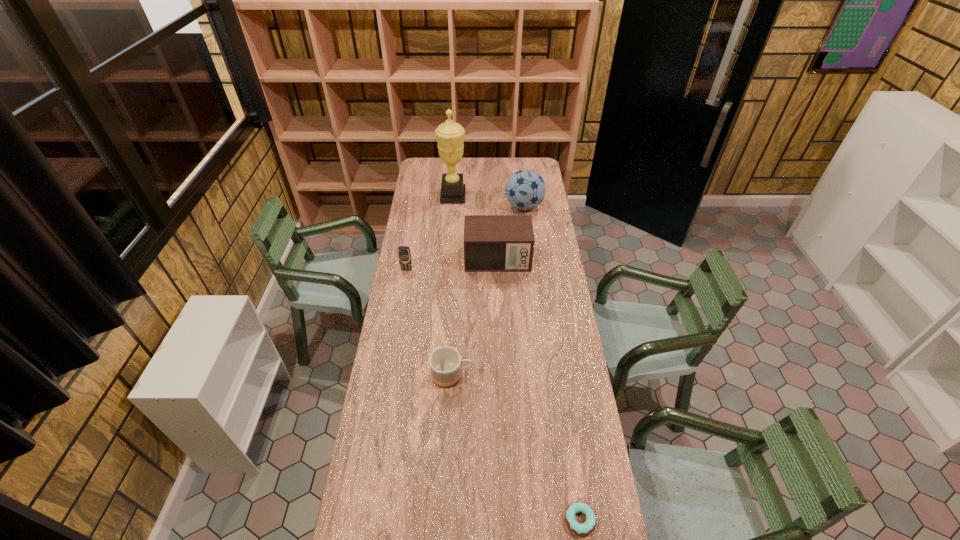
You are a GUI agent. You are given a task and a screenshot of the screen. Output one action in this format:
    pyautogui.click(x=<x>, y=<y>)
    Task: Click on the unoccupied position between the cellular telephone and the shortest object
    
    Given the screenshot: What is the action you would take?
    coord(493,395)

Image resolution: width=960 pixels, height=540 pixels. What are the coordinates of `free space that is in between the nearest object and the soccer ball` in the screenshot? It's located at (552, 363).

The width and height of the screenshot is (960, 540). In order to click on free space between the cellular telephone and the tallest object in this screenshot , I will do `click(430, 233)`.

This screenshot has height=540, width=960. Find the location of `free area in between the doughnut and the mug`. free area in between the doughnut and the mug is located at coordinates (516, 448).

This screenshot has width=960, height=540. Identify the location of vacant space that is in between the tallest object and the fourth tallest object. (430, 233).

Locate which object is the fourth closest to the radio receiver. Please provide its 2D coordinates. Your answer should be formatted as a tuple, i.e. [(x, y)], where the tuple contains the x and y coordinates of a point satisfying the conditions above.

[(445, 362)]

Choose which object is the nearest neighbor to the doughnut. Please provide its 2D coordinates. Your answer should be formatted as a tuple, i.e. [(x, y)], where the tuple contains the x and y coordinates of a point satisfying the conditions above.

[(445, 362)]

At what (x,y) coordinates should I click in order to perform the action: click on free space that satisfies the following two spatial constraints: 1. on the front face of the leftmost object; 2. on the right side of the doughnut. Please return your answer as a coordinate pair (x, y). This screenshot has width=960, height=540. Looking at the image, I should click on (364, 520).

Identify the location of vacant space that satisfies the following two spatial constraints: 1. at the front of the trophy cup with handles; 2. on the left side of the shortest object. The width and height of the screenshot is (960, 540). (429, 520).

In order to click on free space that satisfies the following two spatial constraints: 1. on the side with the handle of the mug; 2. on the back side of the shortest object in this screenshot , I will do `click(445, 520)`.